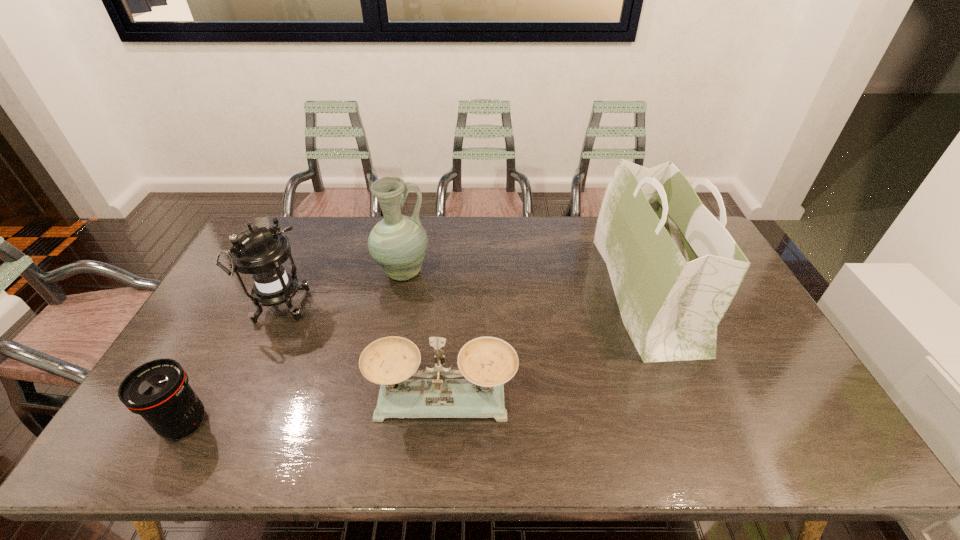
Find the location of `vacant area that lies between the scale and the lantern`. vacant area that lies between the scale and the lantern is located at coordinates (361, 355).

Where is `vacant space that is in between the fourth tallest object and the rightmost object`? The height and width of the screenshot is (540, 960). vacant space that is in between the fourth tallest object and the rightmost object is located at coordinates (544, 346).

Image resolution: width=960 pixels, height=540 pixels. What are the coordinates of `empty space that is in between the telephoto lens and the scale` in the screenshot? It's located at (314, 411).

This screenshot has width=960, height=540. Find the location of `vacant space that is in between the lantern and the rightmost object`. vacant space that is in between the lantern and the rightmost object is located at coordinates (462, 300).

The width and height of the screenshot is (960, 540). What are the coordinates of `vacant region between the scale and the shortest object` in the screenshot? It's located at (314, 411).

The width and height of the screenshot is (960, 540). Identify the location of empty space that is in between the grocery bag and the pitcher. (524, 282).

The width and height of the screenshot is (960, 540). I want to click on vacant area between the rightmost object and the lantern, so click(x=462, y=300).

Find the location of a particular element. free space between the grocery bag and the scale is located at coordinates (544, 346).

I want to click on vacant region between the lantern and the pitcher, so click(x=341, y=291).

Identify the location of object that is the second closest one to the pitcher. (487, 363).